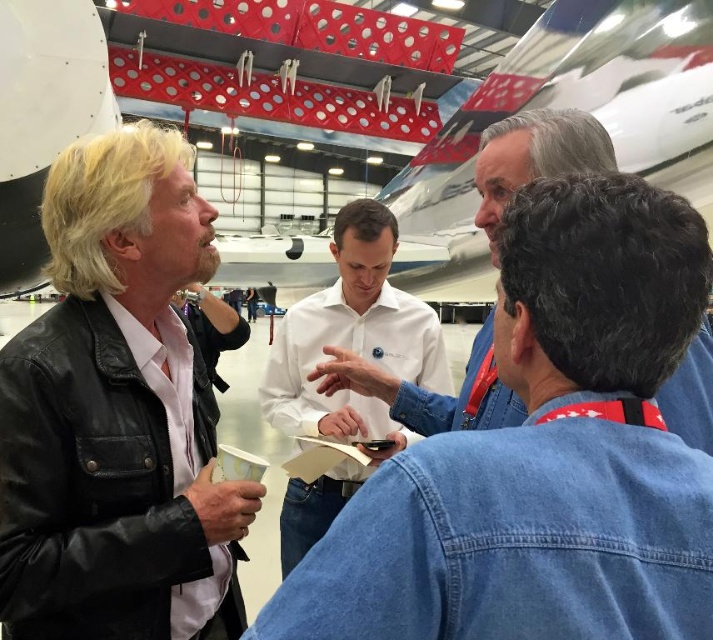
You are an event planner setting up a photo shoot in the hangar. You need to ensure that the white glossy airplane at upper center and the denim shirt at center are visible in the same frame. Based on their positions, will the airplane block the view of the denim shirt when taking a photo from the front entrance?

The white glossy airplane at upper center is positioned over the denim shirt at center, so when taking a photo from the front entrance, the airplane will block the view of the denim shirt at center.

You are an event planner setting up a photo shoot in the hangar. You need to position a camera to capture both the white glossy airplane at upper center and the denim shirt at center. Based on their sizes, which object should be placed closer to the camera to ensure both appear balanced in the frame?

The denim shirt at center should be placed closer to the camera because the white glossy airplane at upper center is larger in size than the denim shirt at center, so moving the smaller denim shirt forward will help balance their sizes in the photo.